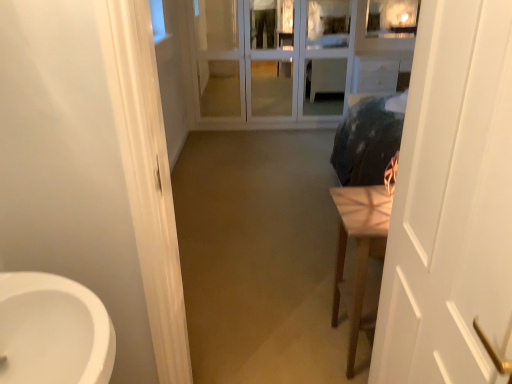
The height and width of the screenshot is (384, 512). I want to click on free spot above light brown wooden table at right (from a real-world perspective), so click(366, 208).